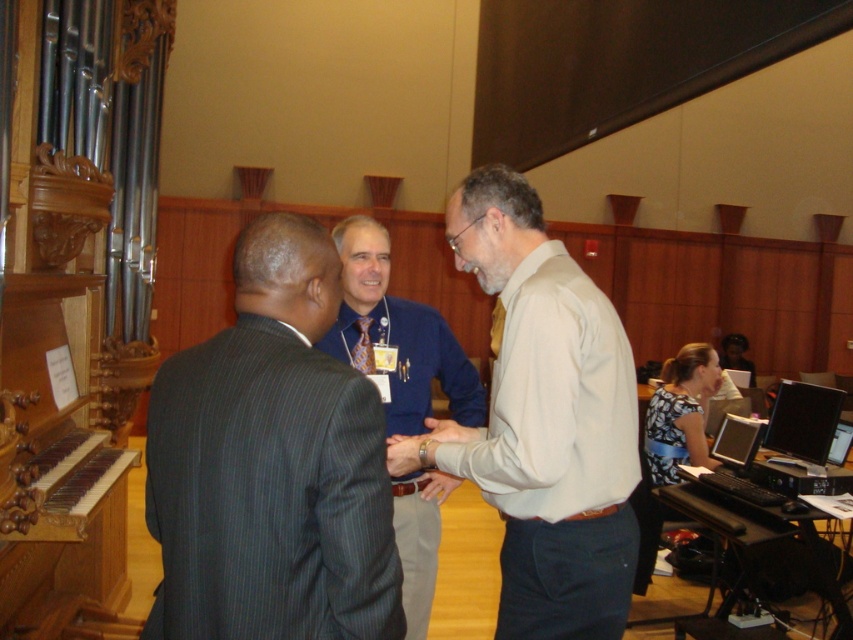
Question: Estimate the real-world distances between objects in this image. Which object is farther from the blue shirt at center?

Choices:
 (A) dark gray pinstripe suit at center
 (B) light beige shirt at center

Answer: (A)

Question: Based on their relative distances, which object is nearer to the blue shirt at center?

Choices:
 (A) light beige shirt at center
 (B) dark gray pinstripe suit at center

Answer: (A)

Question: Which point is closer to the camera taking this photo?

Choices:
 (A) (480, 397)
 (B) (624, 410)
 (C) (292, 534)

Answer: (C)

Question: Is light beige shirt at center thinner than blue shirt at center?

Choices:
 (A) yes
 (B) no

Answer: (B)

Question: Does dark gray pinstripe suit at center appear on the right side of light beige shirt at center?

Choices:
 (A) yes
 (B) no

Answer: (B)

Question: Is dark gray pinstripe suit at center to the right of light beige shirt at center from the viewer's perspective?

Choices:
 (A) no
 (B) yes

Answer: (A)